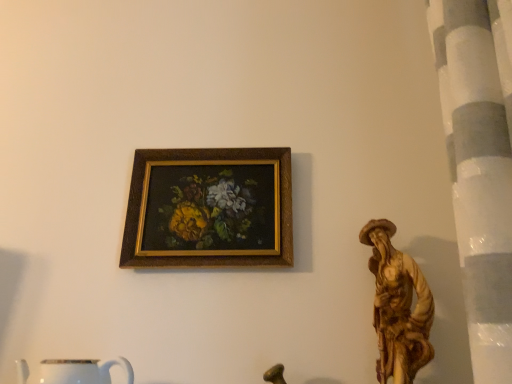
This screenshot has height=384, width=512. Describe the element at coordinates (209, 208) in the screenshot. I see `wooden frame at upper center` at that location.

You are a GUI agent. You are given a task and a screenshot of the screen. Output one action in this format:
    pyautogui.click(x=<x>, y=<y>)
    Task: Click on the wooden frame at upper center
    This screenshot has width=512, height=384.
    Given the screenshot: What is the action you would take?
    pyautogui.click(x=209, y=208)

Image resolution: width=512 pixels, height=384 pixels. What do you see at coordinates (82, 371) in the screenshot? I see `white glossy mug at lower left` at bounding box center [82, 371].

Locate an element on the screen. Image resolution: width=512 pixels, height=384 pixels. white glossy mug at lower left is located at coordinates (82, 371).

Locate an element on the screen. wooden frame at upper center is located at coordinates (209, 208).

Considering the positions of objects white glossy mug at lower left and wooden frame at upper center in the image provided, who is more to the left, white glossy mug at lower left or wooden frame at upper center?

white glossy mug at lower left is more to the left.

Is white glossy mug at lower left positioned in front of wooden frame at upper center?

Yes, the depth of white glossy mug at lower left is less than that of wooden frame at upper center.

Considering the points (46, 366) and (145, 202), which point is behind, point (46, 366) or point (145, 202)?

The point (145, 202) is more distant.

From the image's perspective, is white glossy mug at lower left above or below wooden frame at upper center?

Based on their image positions, white glossy mug at lower left is located beneath wooden frame at upper center.

From a real-world perspective, is white glossy mug at lower left below wooden frame at upper center?

Yes, from a real-world perspective, white glossy mug at lower left is below wooden frame at upper center.

In the scene shown: Which object is thinner, white glossy mug at lower left or wooden frame at upper center?

wooden frame at upper center is thinner.

Which of these two, white glossy mug at lower left or wooden frame at upper center, stands shorter?

With less height is white glossy mug at lower left.

Considering the relative sizes of white glossy mug at lower left and wooden frame at upper center in the image provided, is white glossy mug at lower left smaller than wooden frame at upper center?

No.

Which is correct: white glossy mug at lower left is inside wooden frame at upper center, or outside of it?

white glossy mug at lower left is not inside wooden frame at upper center, it's outside.

Does white glossy mug at lower left touch wooden frame at upper center?

No, white glossy mug at lower left is not beside wooden frame at upper center.

Is white glossy mug at lower left aimed at wooden frame at upper center?

No.

Image resolution: width=512 pixels, height=384 pixels. In order to click on picture frame on the right of white glossy mug at lower left in this screenshot , I will do `click(209, 208)`.

Would you say wooden frame at upper center is to the left or to the right of white glossy mug at lower left in the picture?

From the image, it's evident that wooden frame at upper center is to the right of white glossy mug at lower left.

From the picture: Relative to white glossy mug at lower left, is wooden frame at upper center in front or behind?

In the image, wooden frame at upper center appears behind white glossy mug at lower left.

Which is closer, (195, 233) or (129, 381)?

The point (129, 381) is in front.

From the image's perspective, which is above, wooden frame at upper center or white glossy mug at lower left?

From the image's view, wooden frame at upper center is above.

Consider the image. From a real-world perspective, between wooden frame at upper center and white glossy mug at lower left, who is vertically lower?

white glossy mug at lower left, from a real-world perspective.

Looking at this image, which object is thinner, wooden frame at upper center or white glossy mug at lower left?

Thinner between the two is wooden frame at upper center.

In the scene shown: Considering the sizes of objects wooden frame at upper center and white glossy mug at lower left in the image provided, who is taller, wooden frame at upper center or white glossy mug at lower left?

wooden frame at upper center is taller.

Considering the sizes of objects wooden frame at upper center and white glossy mug at lower left in the image provided, who is bigger, wooden frame at upper center or white glossy mug at lower left?

white glossy mug at lower left.

Is wooden frame at upper center not inside white glossy mug at lower left?

Yes.

Would you say wooden frame at upper center is a long distance from white glossy mug at lower left?

They are positioned close to each other.

Is wooden frame at upper center facing towards white glossy mug at lower left?

No, wooden frame at upper center is not facing towards white glossy mug at lower left.

How different are the orientations of wooden frame at upper center and white glossy mug at lower left in degrees?

The facing directions of wooden frame at upper center and white glossy mug at lower left are 1.46 degrees apart.

This screenshot has width=512, height=384. Find the location of `mug below the wooden frame at upper center (from the image's perspective)`. mug below the wooden frame at upper center (from the image's perspective) is located at coordinates (82, 371).

You are a GUI agent. You are given a task and a screenshot of the screen. Output one action in this format:
    pyautogui.click(x=<x>, y=<y>)
    Task: Click on the mug below the wooden frame at upper center (from a real-world perspective)
    
    Given the screenshot: What is the action you would take?
    pyautogui.click(x=82, y=371)

I want to click on picture frame that appears above the white glossy mug at lower left (from a real-world perspective), so [x=209, y=208].